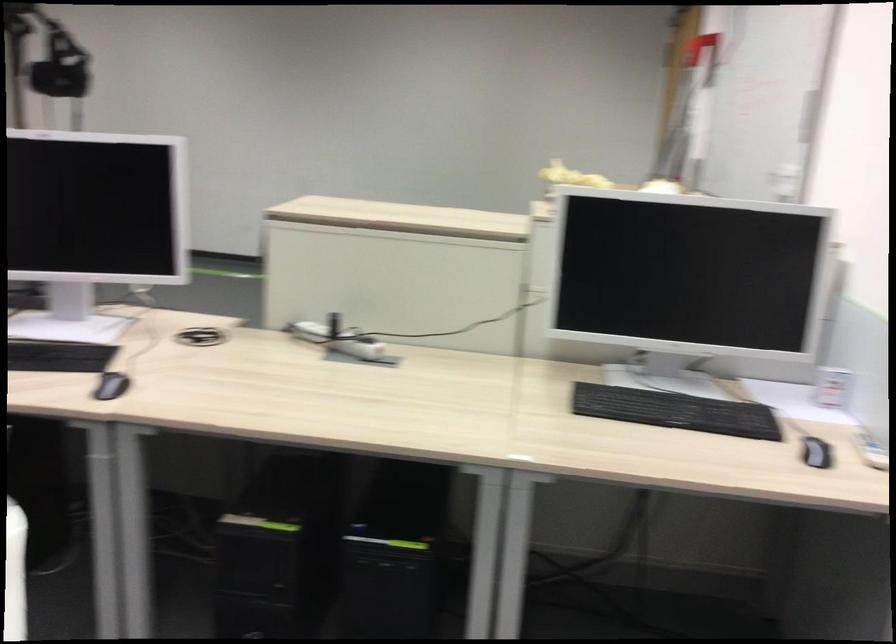
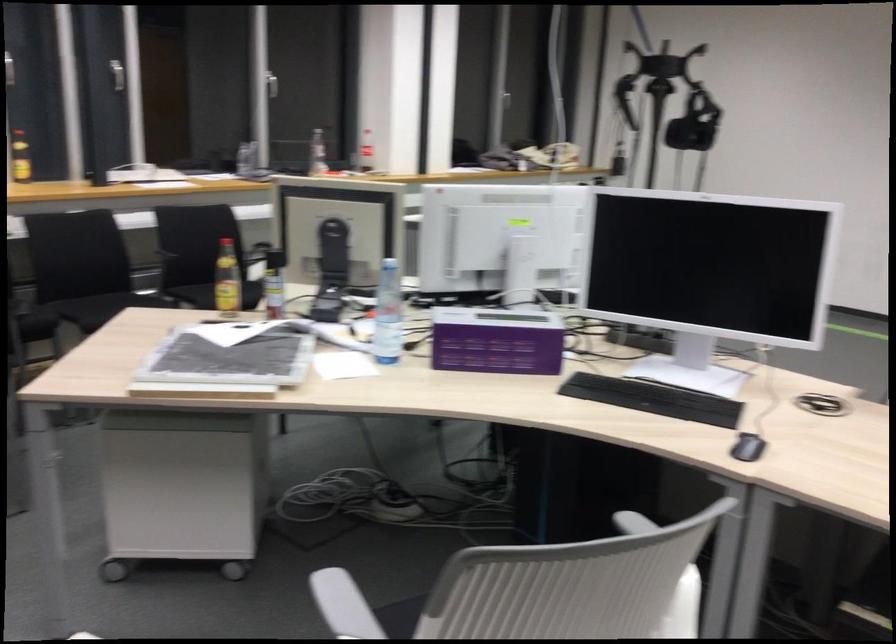
The point at (113,389) is marked in the first image. Where is the corresponding point in the second image?

(747, 447)